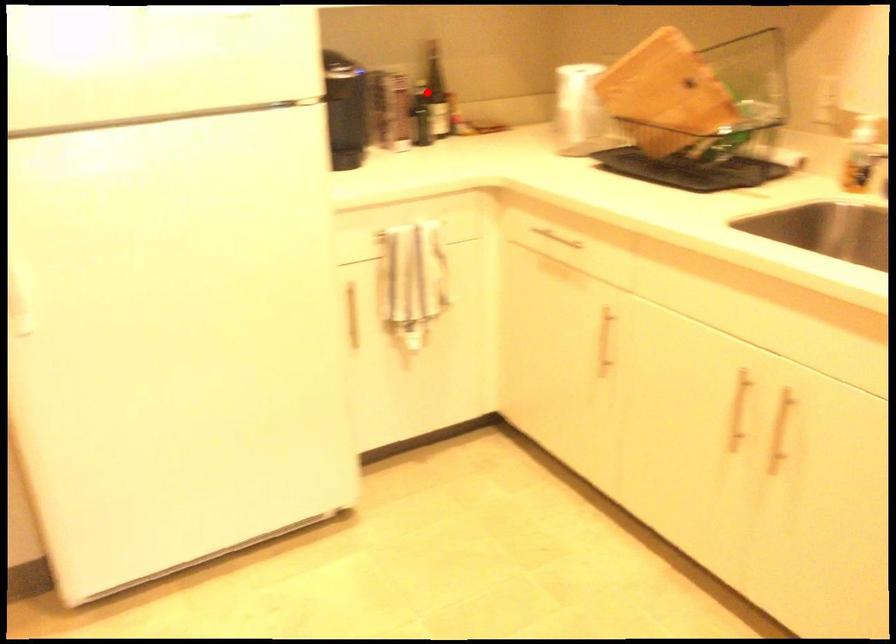
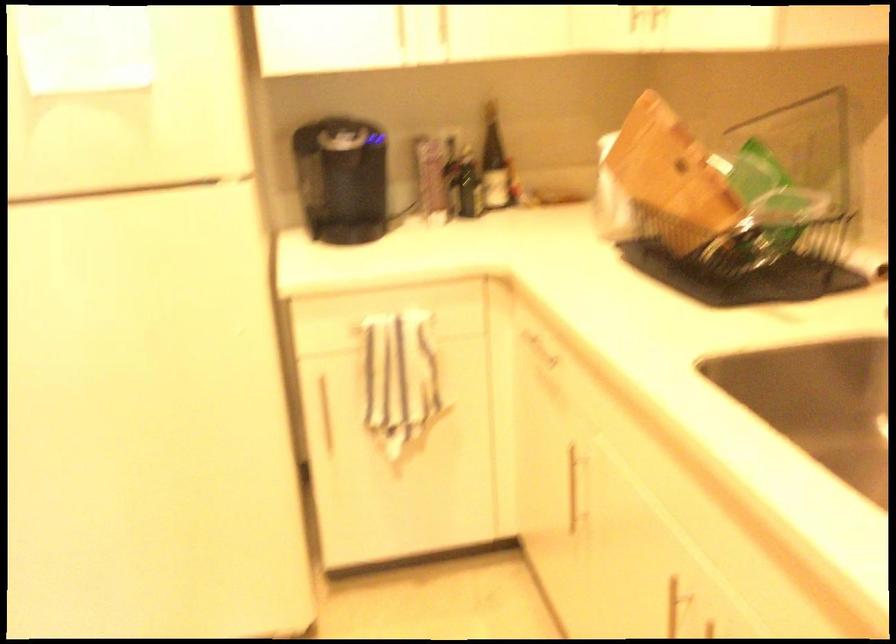
Locate, in the second image, the point that corresponds to the highlighted location in the first image.

(494, 163)